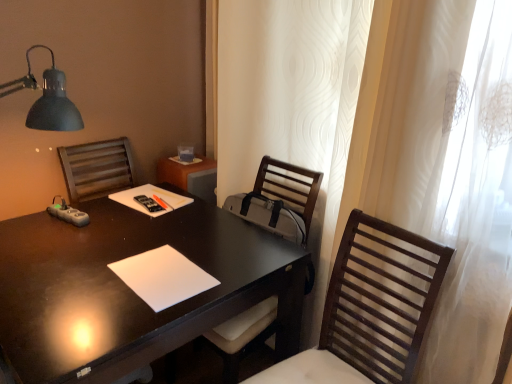
Question: Considering the relative sizes of wooden slats chair at right, marked as the first chair in a front-to-back arrangement, and white sheer curtain at right in the image provided, is wooden slats chair at right, marked as the first chair in a front-to-back arrangement, thinner than white sheer curtain at right?

Choices:
 (A) yes
 (B) no

Answer: (B)

Question: Does wooden slats chair at right, which is the 2th chair in back-to-front order, have a smaller size compared to white sheer curtain at right?

Choices:
 (A) no
 (B) yes

Answer: (B)

Question: From a real-world perspective, is wooden slats chair at right, marked as the first chair in a front-to-back arrangement, on top of white sheer curtain at right?

Choices:
 (A) no
 (B) yes

Answer: (A)

Question: Is wooden slats chair at right, which is the 2th chair in back-to-front order, located outside white sheer curtain at right?

Choices:
 (A) no
 (B) yes

Answer: (B)

Question: Is wooden slats chair at right, which is the 2th chair in back-to-front order, taller than white sheer curtain at right?

Choices:
 (A) yes
 (B) no

Answer: (B)

Question: Does wooden slats chair at right, which is the 2th chair in back-to-front order, lie behind white sheer curtain at right?

Choices:
 (A) no
 (B) yes

Answer: (A)

Question: Is black glossy desk at center at the right side of white matte notepad at center?

Choices:
 (A) yes
 (B) no

Answer: (B)

Question: From the image's perspective, is black glossy desk at center below white matte notepad at center?

Choices:
 (A) yes
 (B) no

Answer: (A)

Question: Is black glossy desk at center directly adjacent to white matte notepad at center?

Choices:
 (A) yes
 (B) no

Answer: (B)

Question: Does black glossy desk at center have a greater width compared to white matte notepad at center?

Choices:
 (A) yes
 (B) no

Answer: (A)

Question: From a real-world perspective, is black glossy desk at center physically below white matte notepad at center?

Choices:
 (A) yes
 (B) no

Answer: (A)

Question: Is black glossy desk at center at the left side of white matte notepad at center?

Choices:
 (A) no
 (B) yes

Answer: (B)

Question: Considering the relative sizes of black glossy desk at center and white sheer curtain at right in the image provided, is black glossy desk at center shorter than white sheer curtain at right?

Choices:
 (A) no
 (B) yes

Answer: (B)